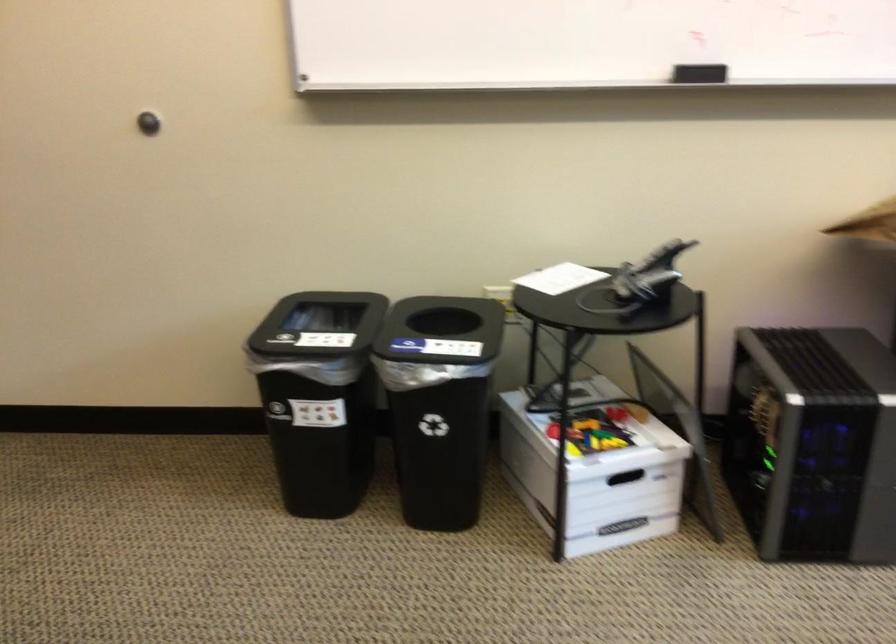
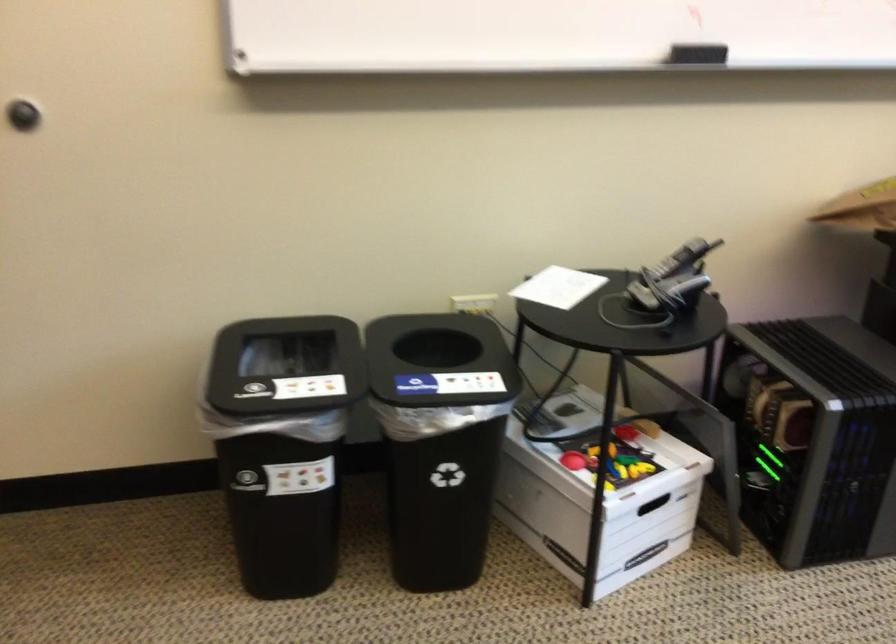
Find the pixel in the second image that matches pixel 701 75 in the first image.

(696, 53)